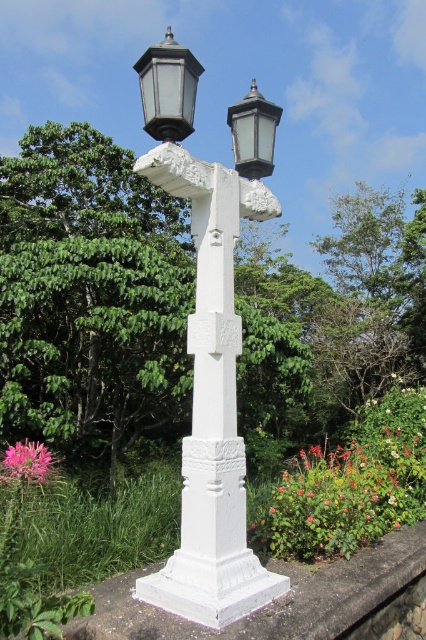
You are a gardener planning to place a new bench in the garden. The bench is 1.2 meters wide. You want to place it between the green leafy tree at center and the matte black lantern at upper right. Can the bench fit there without touching either object?

The green leafy tree at center might be wider than matte black lantern at upper right, so the bench may or may not fit. To be safe, measure the space between them first.

You are standing at the origin point of the coordinate system. You want to walk to the green leafy tree at center. Which direction should you walk?

The green leafy tree at center is located at coordinate point 0.466 on the x axis and 0.214 on the y axis. Since you are at the origin, you should walk in the direction of the first quadrant, moving right along the x axis and up along the y axis to reach the green leafy tree at center.

You are a gardener standing in front of the white stone street light at center and the matte black lantern at upper left. Which object is closer to you?

The white stone street light at center is closer to you because it is in front of the matte black lantern at upper left.